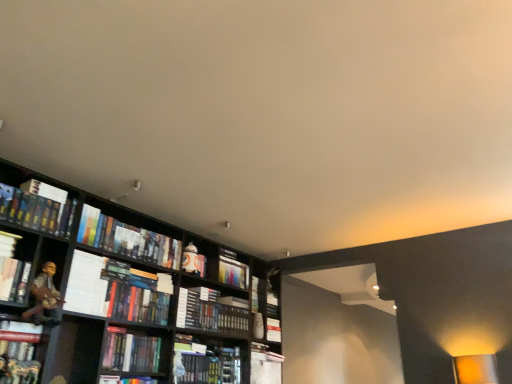
Question: Considering the relative sizes of hardcover book at center, arranged as the 5th book when viewed from the left, and hardcover book at left, positioned as the third book in left-to-right order, in the image provided, is hardcover book at center, arranged as the 5th book when viewed from the left, smaller than hardcover book at left, positioned as the third book in left-to-right order,?

Choices:
 (A) yes
 (B) no

Answer: (A)

Question: Is the depth of hardcover book at center, arranged as the 5th book when viewed from the left, less than that of hardcover book at left, the eighth book positioned from the right?

Choices:
 (A) no
 (B) yes

Answer: (A)

Question: Is hardcover book at center, arranged as the 5th book when viewed from the left, facing towards hardcover book at left, positioned as the third book in left-to-right order?

Choices:
 (A) no
 (B) yes

Answer: (A)

Question: From a real-world perspective, is hardcover book at center, arranged as the 5th book when viewed from the left, physically above hardcover book at left, positioned as the third book in left-to-right order?

Choices:
 (A) yes
 (B) no

Answer: (B)

Question: From the image's perspective, does hardcover book at center, arranged as the 5th book when viewed from the left, appear lower than hardcover book at left, the eighth book positioned from the right?

Choices:
 (A) no
 (B) yes

Answer: (B)

Question: From the image's perspective, is hardcover books at center, placed as the fourth book when sorted from right to left, located above or below matte black book at lower left, marked as the second book in a left-to-right arrangement?

Choices:
 (A) below
 (B) above

Answer: (A)

Question: Considering the positions of hardcover books at center, placed as the fourth book when sorted from right to left, and matte black book at lower left, acting as the ninth book starting from the right, in the image, is hardcover books at center, placed as the fourth book when sorted from right to left, wider or thinner than matte black book at lower left, acting as the ninth book starting from the right,?

Choices:
 (A) wide
 (B) thin

Answer: (A)

Question: Is hardcover books at center, placed as the fourth book when sorted from right to left, inside the boundaries of matte black book at lower left, marked as the second book in a left-to-right arrangement, or outside?

Choices:
 (A) outside
 (B) inside

Answer: (A)

Question: Based on their sizes in the image, would you say hardcover books at center, which is the seventh book from left to right, is bigger or smaller than matte black book at lower left, marked as the second book in a left-to-right arrangement?

Choices:
 (A) small
 (B) big

Answer: (B)

Question: From a real-world perspective, relative to hardcover book at center, the tenth book from the left, is hardcover books at center, which is the seventh book from left to right, vertically above or below?

Choices:
 (A) above
 (B) below

Answer: (A)

Question: Is hardcover books at center, placed as the fourth book when sorted from right to left, wider or thinner than hardcover book at center, positioned as the first book in right-to-left order?

Choices:
 (A) wide
 (B) thin

Answer: (A)

Question: Based on their positions, is hardcover books at center, placed as the fourth book when sorted from right to left, located to the left or right of hardcover book at center, the tenth book from the left?

Choices:
 (A) left
 (B) right

Answer: (A)

Question: Is point (230, 309) positioned closer to the camera than point (276, 324)?

Choices:
 (A) closer
 (B) farther

Answer: (A)

Question: Is point (79, 304) closer or farther from the camera than point (229, 269)?

Choices:
 (A) farther
 (B) closer

Answer: (B)

Question: From a real-world perspective, is white paper at left positioned above or below hardcover book at center, the eighth book in the left-to-right sequence?

Choices:
 (A) below
 (B) above

Answer: (A)